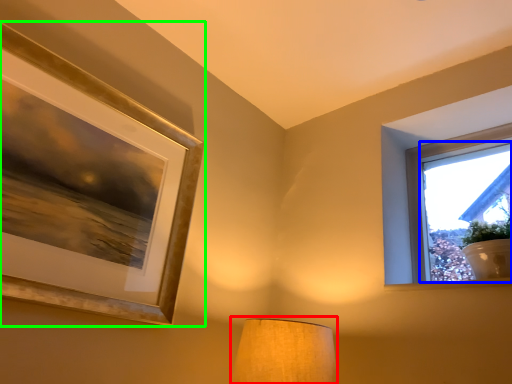
Question: Considering the real-world distances, which object is closest to lamp (highlighted by a red box)? window screen (highlighted by a blue box) or picture frame (highlighted by a green box).

Choices:
 (A) window screen
 (B) picture frame

Answer: (B)